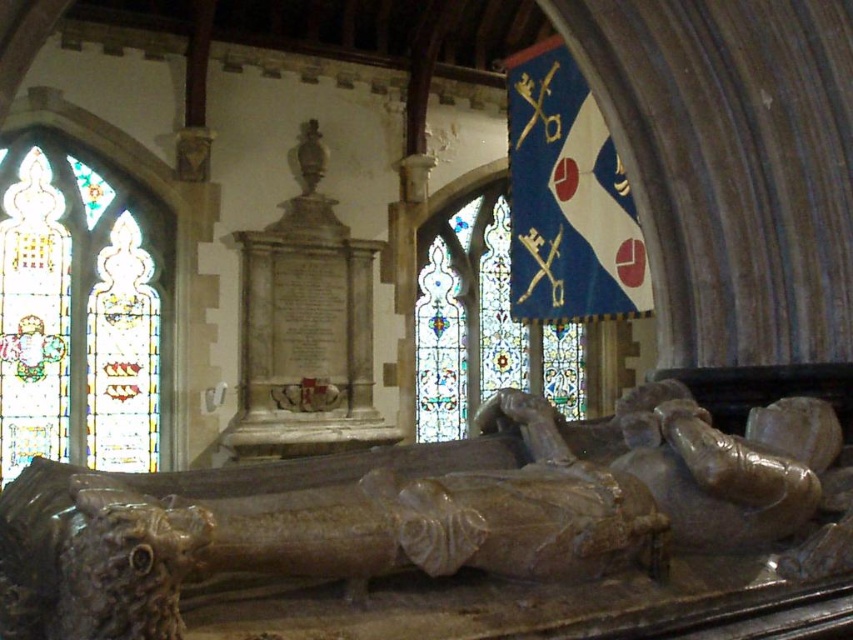
Question: Which of these objects is positioned closest to the brown polished stone effigy at lower center?

Choices:
 (A) stained glass window at left
 (B) blue stained glass at upper center

Answer: (A)

Question: From the image, what is the correct spatial relationship of brown polished stone effigy at lower center in relation to stained glass window at left?

Choices:
 (A) below
 (B) above

Answer: (A)

Question: Among these objects, which one is farthest from the camera?

Choices:
 (A) stained glass window at left
 (B) brown polished stone effigy at lower center

Answer: (A)

Question: Is the position of brown polished stone effigy at lower center more distant than that of stained glass window at left?

Choices:
 (A) no
 (B) yes

Answer: (A)

Question: Does brown polished stone effigy at lower center appear under stained glass window at left?

Choices:
 (A) yes
 (B) no

Answer: (A)

Question: Which object is closer to the camera taking this photo?

Choices:
 (A) stained glass window at left
 (B) blue stained glass at upper center

Answer: (B)